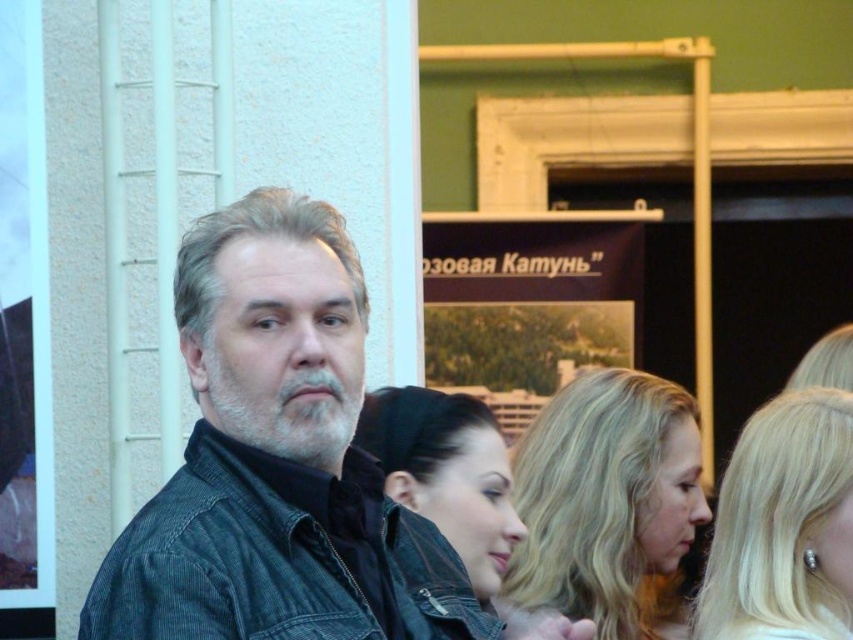
You are a photographer at this event and need to ensure that both the denim jacket at center and the smooth black hair at center are visible in your photo. Given their sizes, which object should you focus on to make sure both are in frame?

The denim jacket at center is bigger than the smooth black hair at center, so you should focus on the denim jacket at center to ensure both are in frame since it takes up more space and is easier to position within the shot.

You are standing in the room and want to move from the point at coordinates point (128, 564) to the point at coordinates point (300, 419). Which direction should you move to get closer to the second point?

Since point (128, 564) is closer to the viewer than point (300, 419), you should move backward to get closer to the second point.

You are standing at the point with coordinates [277,460] in the image. What object are you standing on?

You are standing on the denim jacket at center.